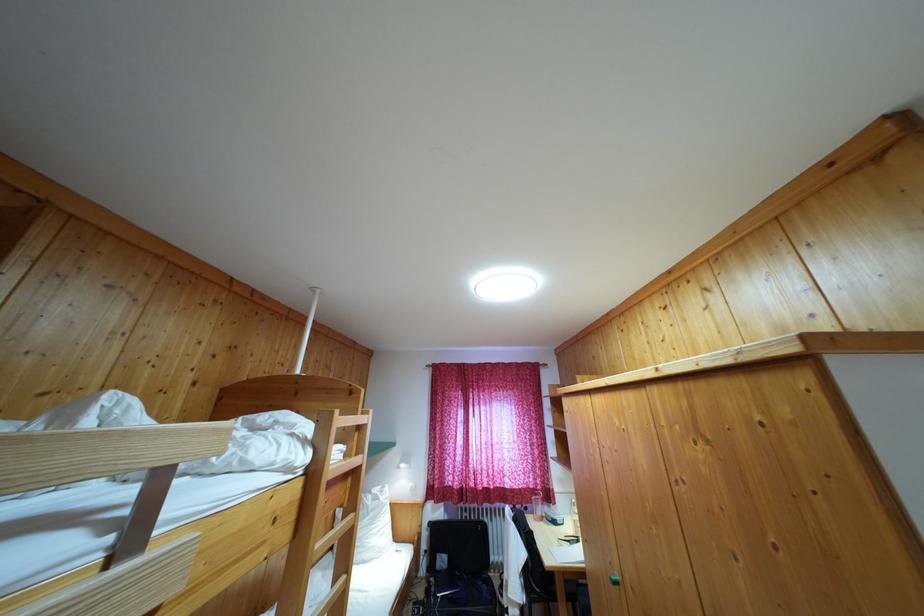
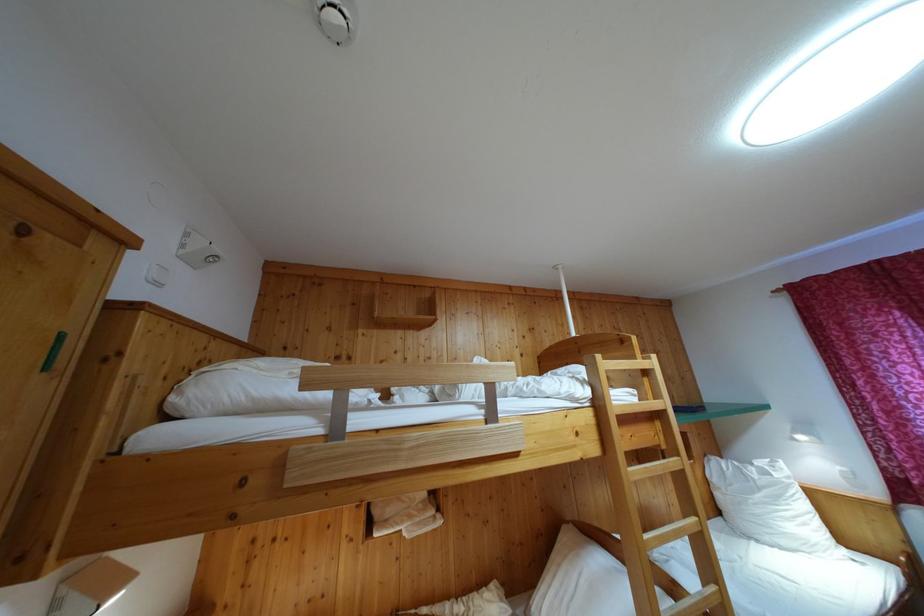
Question: Based on the continuous images, in which direction is the camera rotating? Reply with the corresponding letter.

Choices:
 (A) Left
 (B) Right
 (C) Up
 (D) Down

Answer: (A)